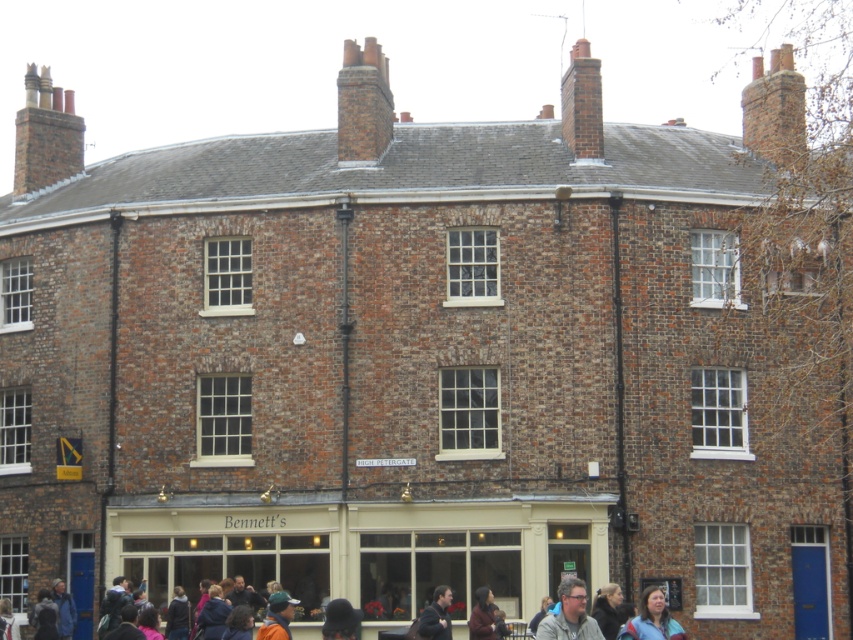
Looking at this image, you are standing in front of the two story brick building. You notice a point at coordinate (569, 614). What object is this point located on?

The point at coordinate (569, 614) is located on the matte gray glasses at lower center.

You are standing in front of the two story brick building and notice a dark blue jacket at lower center and a matte gray glasses at lower center. Which object is located to the left of the other?

The dark blue jacket at lower center is positioned on the left side of matte gray glasses at lower center.